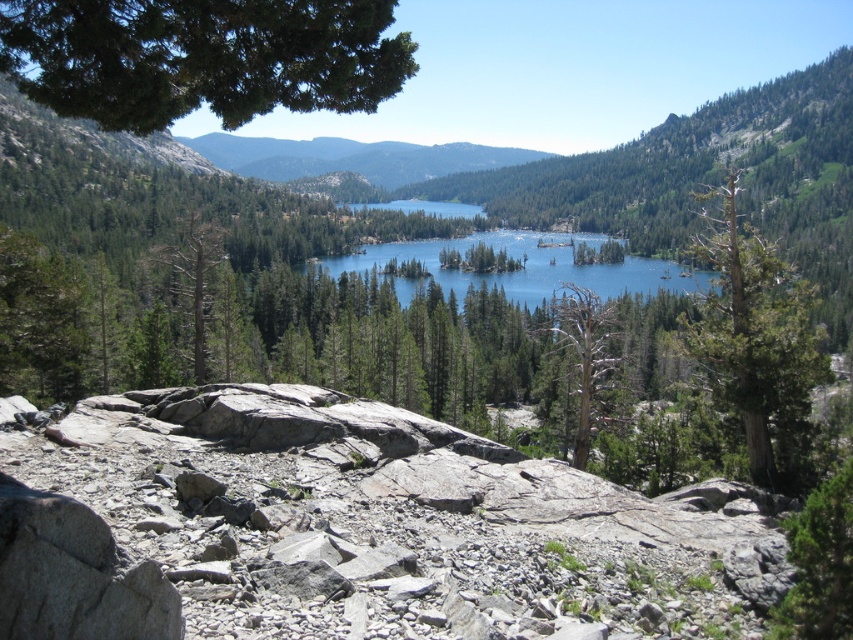
Does green leafy tree at upper left have a greater height compared to brown/dry wood tree at center?

No.

Which is more to the left, green leafy tree at upper left or brown/dry wood tree at center?

Positioned to the left is green leafy tree at upper left.

Between point (67, 97) and point (553, 298), which one is positioned behind?

The point (553, 298) is behind.

I want to click on green leafy tree at upper left, so click(202, 58).

Is green forested mountain at center thinner than green textured tree at center?

No.

The image size is (853, 640). Identify the location of green forested mountain at center. (352, 157).

Is green leafy tree at upper left thinner than green forested mountain at center?

Yes, green leafy tree at upper left is thinner than green forested mountain at center.

The width and height of the screenshot is (853, 640). I want to click on green leafy tree at upper left, so click(x=202, y=58).